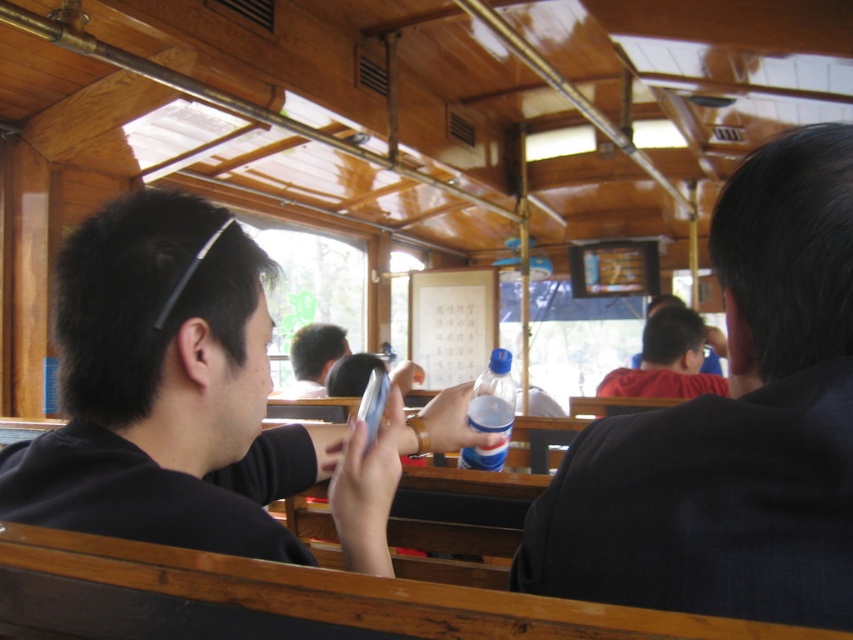
Question: Can you confirm if dark blue suit at right is smaller than black matte phone at left?

Choices:
 (A) no
 (B) yes

Answer: (B)

Question: Which of the following is the farthest from the observer?

Choices:
 (A) click(809, 349)
 (B) click(202, 308)

Answer: (B)

Question: Which object is farther from the camera taking this photo?

Choices:
 (A) black matte phone at left
 (B) dark blue suit at right

Answer: (A)

Question: From the image, what is the correct spatial relationship of dark blue suit at right in relation to black matte phone at left?

Choices:
 (A) right
 (B) left

Answer: (A)

Question: Is dark blue suit at right bigger than black matte phone at left?

Choices:
 (A) no
 (B) yes

Answer: (A)